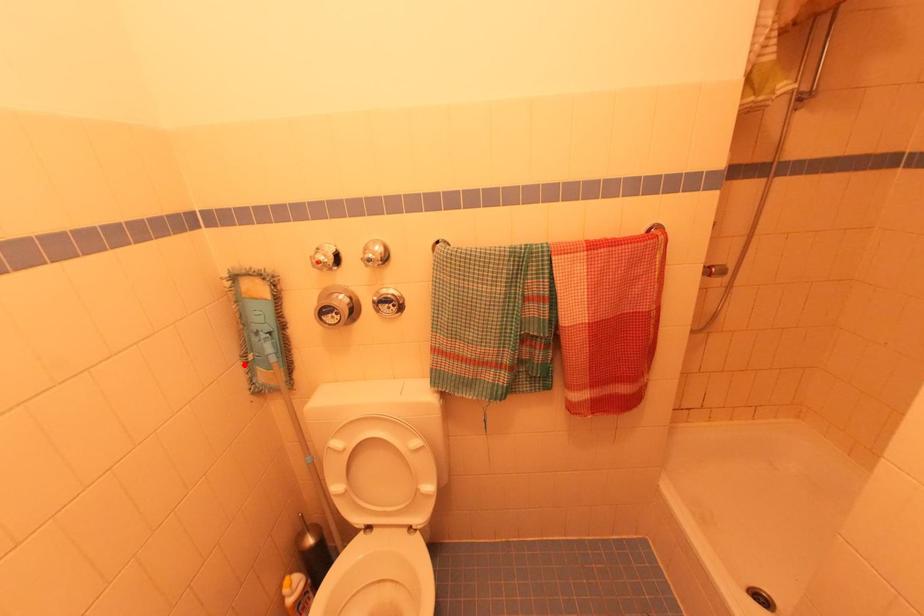
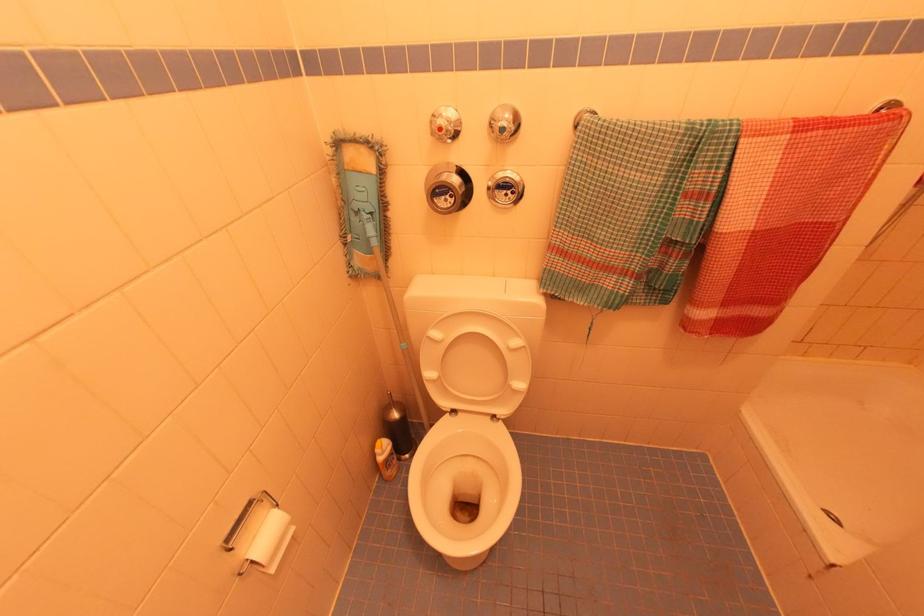
The point at the highlighted location is marked in the first image. Where is the corresponding point in the second image?

(344, 246)